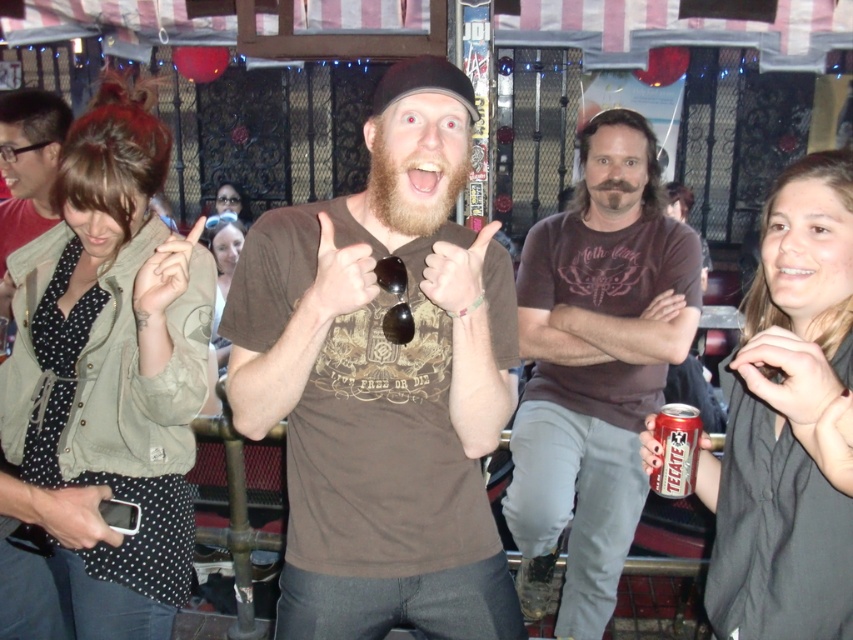
Question: Which point is closer to the camera taking this photo?

Choices:
 (A) (231, 224)
 (B) (830, 301)
 (C) (672, 468)

Answer: (B)

Question: Observing the image, what is the correct spatial positioning of brown matte t-shirt at center in reference to matte black shirt at center?

Choices:
 (A) below
 (B) above

Answer: (B)

Question: Estimate the real-world distances between objects in this image. Which object is farther from the matte black jacket at center?

Choices:
 (A) green textured jacket at left
 (B) brown matte t-shirt at center

Answer: (B)

Question: Is green textured jacket at left further to camera compared to red metallic can at lower right?

Choices:
 (A) yes
 (B) no

Answer: (A)

Question: Which object is farther from the camera taking this photo?

Choices:
 (A) brown cotton t-shirt at center
 (B) matte black shirt at center

Answer: (A)

Question: Is red metallic can at lower right to the right of matte black jacket at center from the viewer's perspective?

Choices:
 (A) yes
 (B) no

Answer: (A)